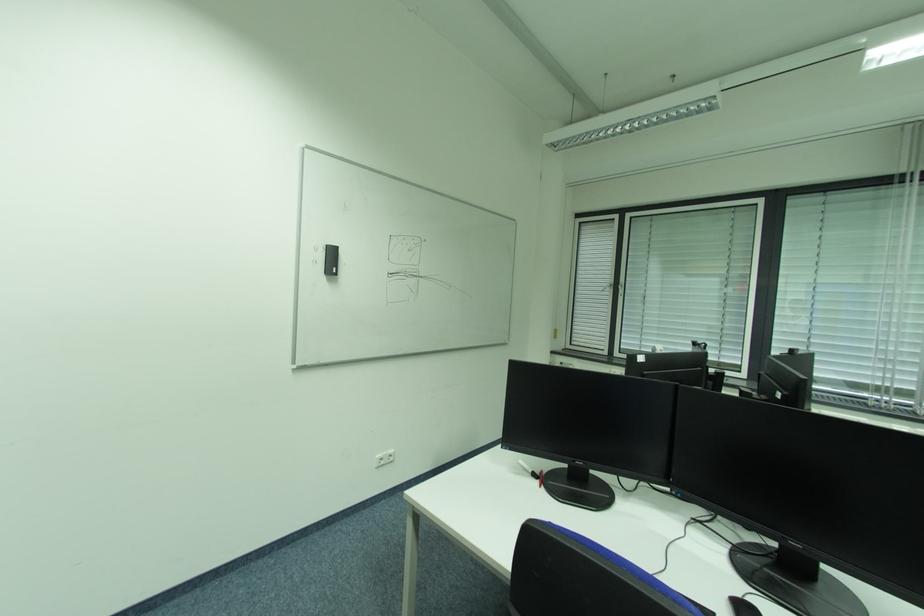
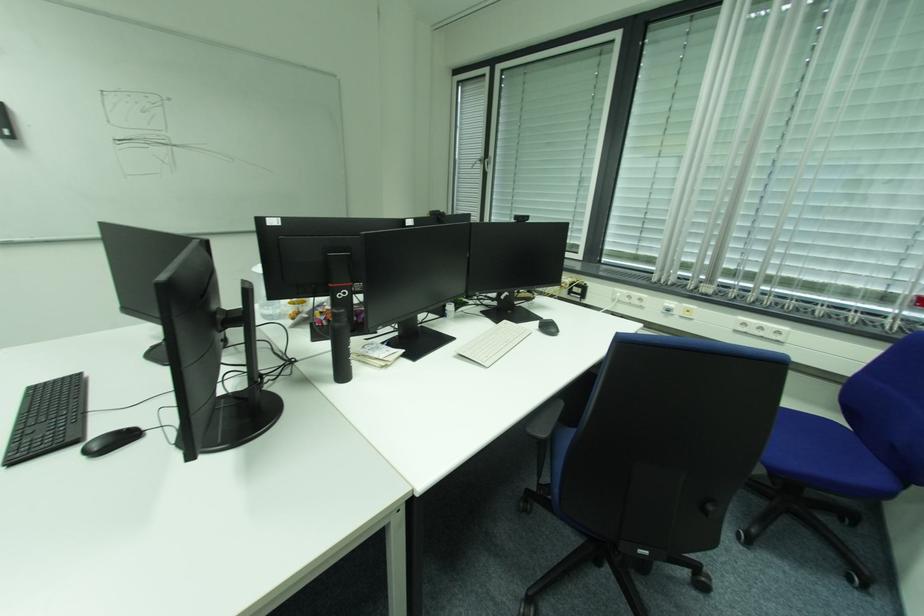
Question: In a continuous first-person perspective shot, in which direction is the camera moving?

Choices:
 (A) Left
 (B) Right
 (C) Forward
 (D) Backward

Answer: (B)